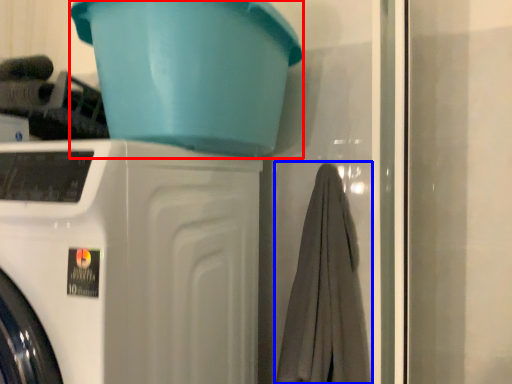
Question: Which point is further to the camera, basin (highlighted by a red box) or bath towel (highlighted by a blue box)?

Choices:
 (A) basin
 (B) bath towel

Answer: (B)